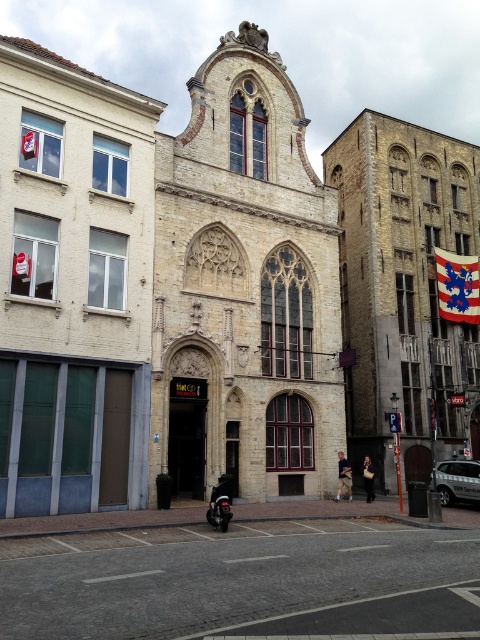
Is blue felt flag at upper right taller than dark gray leather jacket at center?

Correct, blue felt flag at upper right is much taller as dark gray leather jacket at center.

Is point (458, 312) positioned after point (346, 486)?

Yes, it is.

Who is more forward, (448, 304) or (343, 483)?

Point (343, 483) is more forward.

You are a GUI agent. You are given a task and a screenshot of the screen. Output one action in this format:
    pyautogui.click(x=<x>, y=<y>)
    Task: Click on the blue felt flag at upper right
    
    Given the screenshot: What is the action you would take?
    pyautogui.click(x=457, y=285)

Can you confirm if shiny black motorcycle at center is taller than dark gray leather jacket at center?

Indeed, shiny black motorcycle at center has a greater height compared to dark gray leather jacket at center.

Measure the distance between point (x=227, y=497) and camera.

Point (x=227, y=497) and camera are 33.30 meters apart from each other.

What do you see at coordinates (219, 502) in the screenshot? The height and width of the screenshot is (640, 480). I see `shiny black motorcycle at center` at bounding box center [219, 502].

I want to click on shiny black motorcycle at center, so click(x=219, y=502).

Is beige stone church at center positioned in front of dark gray leather jacket at center?

That is True.

Identify the location of beige stone church at center. (244, 288).

Between point (222, 182) and point (348, 496), which one is positioned behind?

The point (348, 496) is more distant.

Where is `beige stone church at center`? The height and width of the screenshot is (640, 480). beige stone church at center is located at coordinates tap(244, 288).